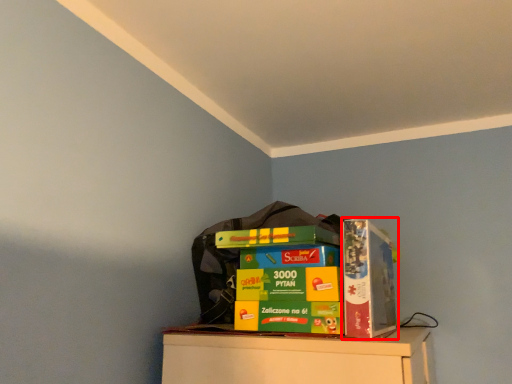
Question: Considering the relative positions of paperback book (annotated by the red box) and collection in the image provided, where is paperback book (annotated by the red box) located with respect to the staircase?

Choices:
 (A) right
 (B) left

Answer: (A)